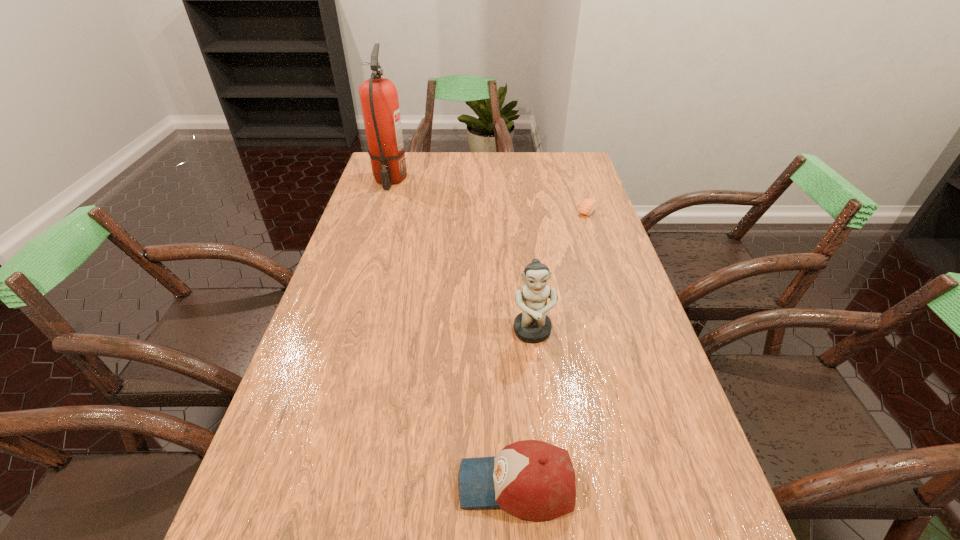
You are a GUI agent. You are given a task and a screenshot of the screen. Output one action in this format:
    pyautogui.click(x=<x>, y=<y>)
    Task: Click on the vacant region at the far right corner of the desktop
    This screenshot has width=960, height=540.
    Given the screenshot: What is the action you would take?
    pyautogui.click(x=565, y=170)

The image size is (960, 540). What are the coordinates of `vacant space in between the third shortest object and the leftmost object` in the screenshot? It's located at (461, 256).

At what (x,y) coordinates should I click in order to perform the action: click on blank region between the leftmost object and the second farthest object. Please return your answer as a coordinate pair (x, y). This screenshot has width=960, height=540. Looking at the image, I should click on (489, 195).

Where is `free space between the third nearest object and the nearest object`? Image resolution: width=960 pixels, height=540 pixels. free space between the third nearest object and the nearest object is located at coordinates (552, 348).

Locate an element on the screen. The width and height of the screenshot is (960, 540). vacant space in between the tallest object and the sushi is located at coordinates (489, 195).

This screenshot has width=960, height=540. In order to click on vacant region between the nearest object and the tallest object in this screenshot , I will do pyautogui.click(x=453, y=332).

Find the location of `vacant point located between the third nearest object and the leftmost object`. vacant point located between the third nearest object and the leftmost object is located at coordinates (489, 195).

Locate an element on the screen. vacant area that lies between the tallest object and the figurine is located at coordinates (461, 256).

Identify the location of vacant region between the sushi and the tallest object. The image size is (960, 540). (489, 195).

Locate an element on the screen. unoccupied position between the leftmost object and the third tallest object is located at coordinates pos(453,332).